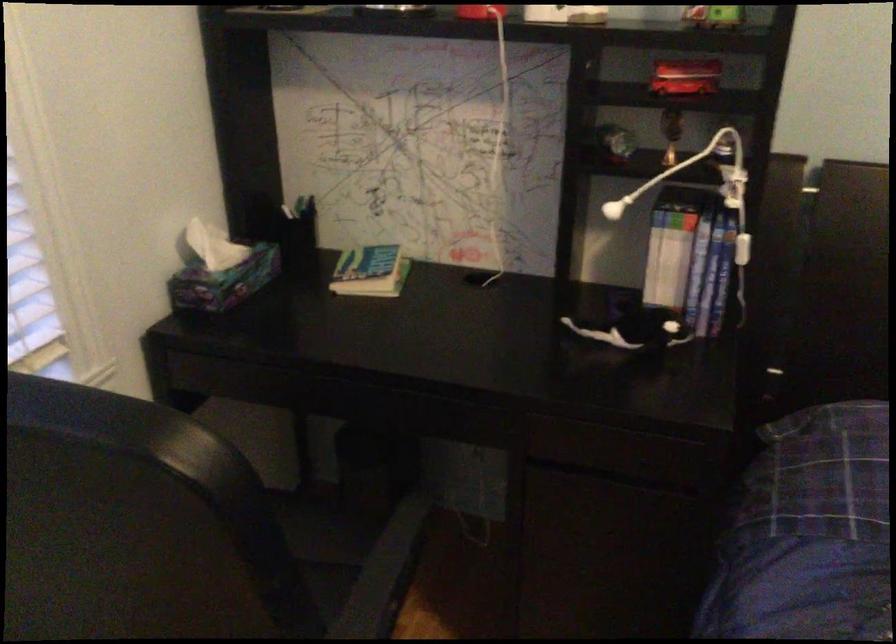
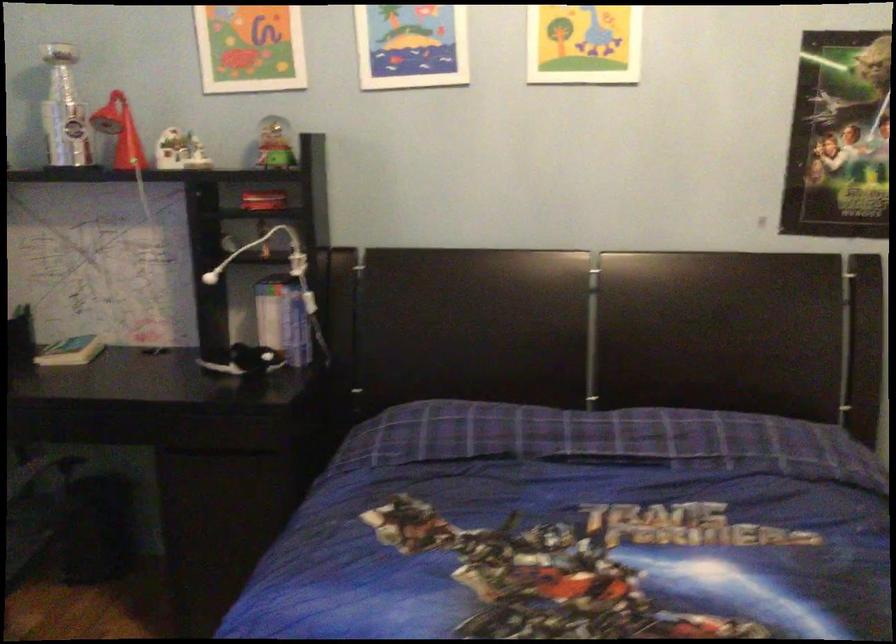
The point at (695,274) is marked in the first image. Where is the corresponding point in the second image?

(288, 321)